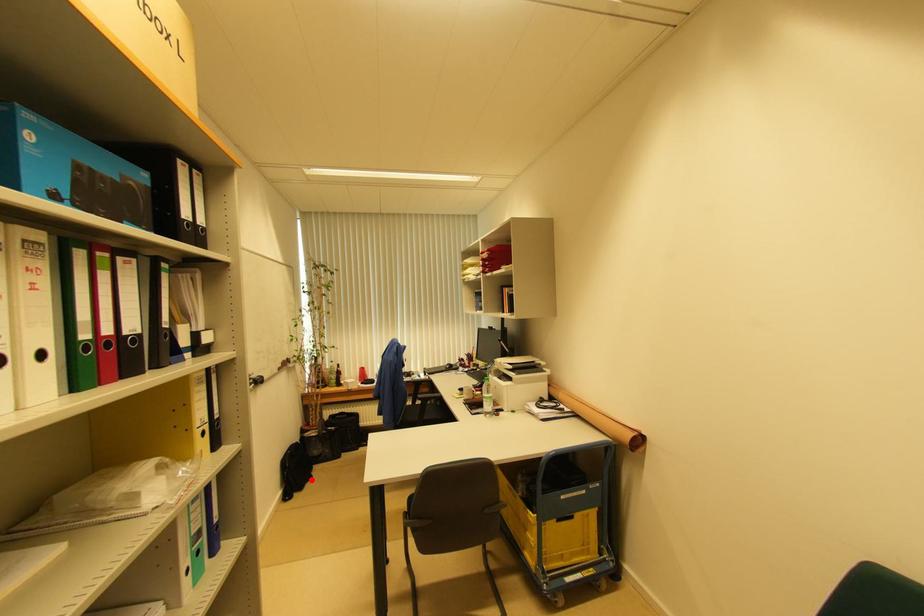
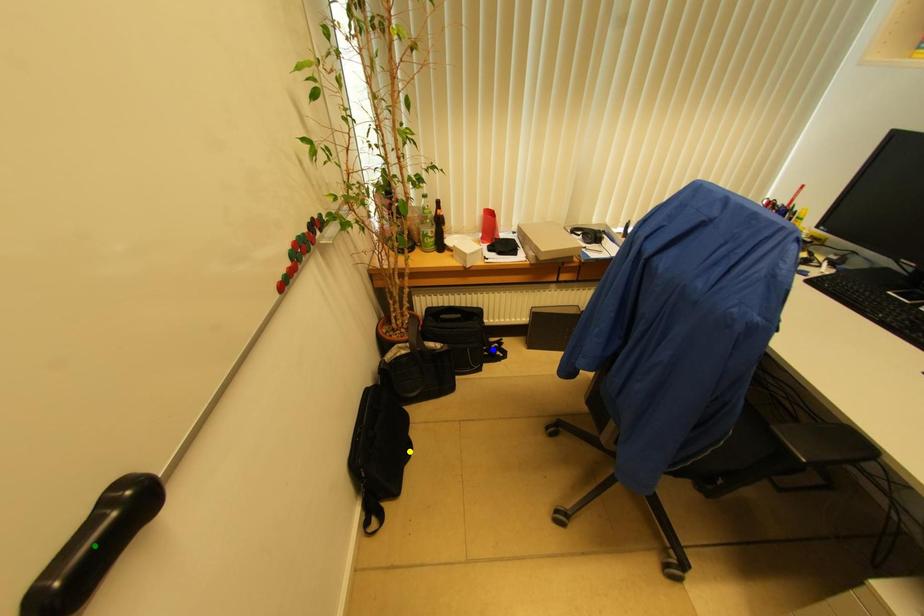
Question: I am providing you with two images of the same scene from different viewpoints. A red point is marked on the first image. You are given multiple points on the second image. Which mark in image 2 goes with the point in image 1?

Choices:
 (A) yellow point
 (B) green point
 (C) blue point

Answer: (A)